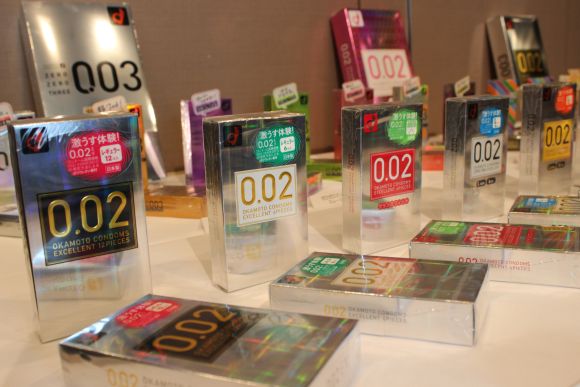
Where is `paneled wall`? Image resolution: width=580 pixels, height=387 pixels. paneled wall is located at coordinates (223, 41), (447, 19), (568, 17).